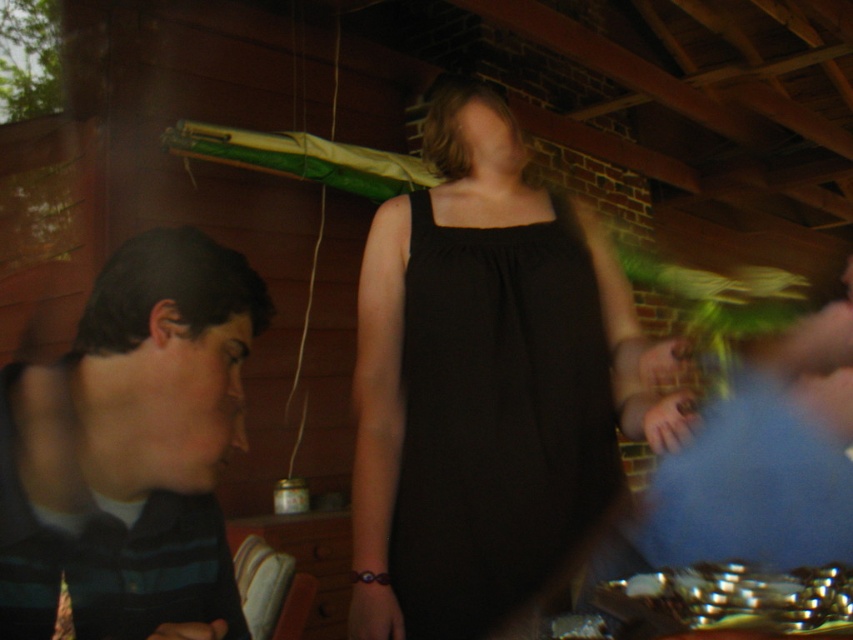
Does black matte dress at center have a greater width compared to shiny metallic utensils at lower right?

Yes.

Is black matte dress at center taller than shiny metallic utensils at lower right?

Yes, black matte dress at center is taller than shiny metallic utensils at lower right.

Who is more distant from viewer, (x=440, y=264) or (x=695, y=589)?

Positioned behind is point (x=440, y=264).

I want to click on black matte dress at center, so click(497, 419).

Does striped fabric shirt at left appear under shiny metallic utensils at lower right?

No, striped fabric shirt at left is not below shiny metallic utensils at lower right.

Who is more forward, (212, 508) or (645, 614)?

Point (212, 508)

This screenshot has width=853, height=640. I want to click on striped fabric shirt at left, so click(131, 445).

Identify the location of striped fabric shirt at left. (131, 445).

Does point (67, 381) come behind point (573, 369)?

No.

Which is behind, point (152, 508) or point (496, 616)?

Positioned behind is point (496, 616).

Find the location of `striped fabric shirt at left`. striped fabric shirt at left is located at coordinates (131, 445).